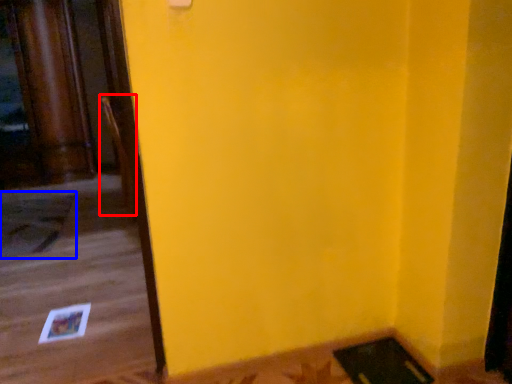
Question: Among these objects, which one is farthest to the camera, chair (highlighted by a red box) or doormat (highlighted by a blue box)?

Choices:
 (A) chair
 (B) doormat

Answer: (A)